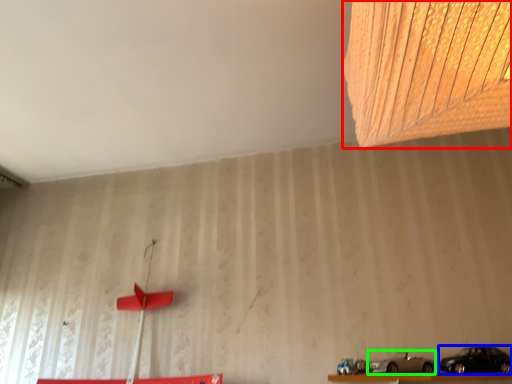
Question: Based on their relative distances, which object is farther from lamp (highlighted by a red box)? Choose from car (highlighted by a blue box) and car (highlighted by a green box).

Choices:
 (A) car
 (B) car

Answer: (B)